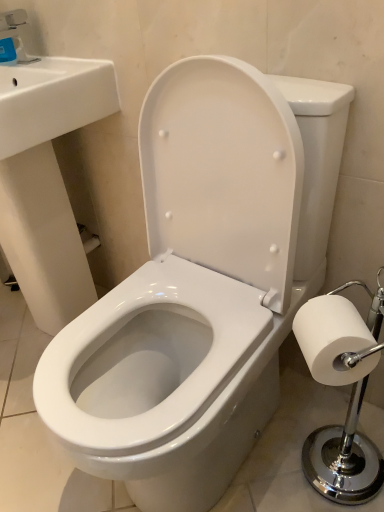
Question: Is white glossy sink at upper left located within matte blue plastic faucet at upper left?

Choices:
 (A) no
 (B) yes

Answer: (A)

Question: Is matte blue plastic faucet at upper left thinner than white glossy sink at upper left?

Choices:
 (A) no
 (B) yes

Answer: (B)

Question: Is matte blue plastic faucet at upper left to the left of white glossy sink at upper left from the viewer's perspective?

Choices:
 (A) yes
 (B) no

Answer: (A)

Question: Does matte blue plastic faucet at upper left lie behind white glossy sink at upper left?

Choices:
 (A) no
 (B) yes

Answer: (B)

Question: From a real-world perspective, is matte blue plastic faucet at upper left under white glossy sink at upper left?

Choices:
 (A) yes
 (B) no

Answer: (B)

Question: Is matte blue plastic faucet at upper left next to white glossy sink at upper left and touching it?

Choices:
 (A) yes
 (B) no

Answer: (B)

Question: Can you confirm if white paper at right is positioned to the left of white glossy sink at upper left?

Choices:
 (A) yes
 (B) no

Answer: (B)

Question: From a real-world perspective, does white paper at right sit lower than white glossy sink at upper left?

Choices:
 (A) no
 (B) yes

Answer: (B)

Question: From the image's perspective, is white paper at right located beneath white glossy sink at upper left?

Choices:
 (A) no
 (B) yes

Answer: (B)

Question: Can you confirm if white paper at right is positioned to the right of white glossy sink at upper left?

Choices:
 (A) no
 (B) yes

Answer: (B)

Question: Are white paper at right and white glossy sink at upper left beside each other?

Choices:
 (A) no
 (B) yes

Answer: (A)

Question: From a real-world perspective, is white paper at right over white glossy sink at upper left?

Choices:
 (A) no
 (B) yes

Answer: (A)

Question: Is matte blue plastic faucet at upper left bigger than white paper at right?

Choices:
 (A) yes
 (B) no

Answer: (B)